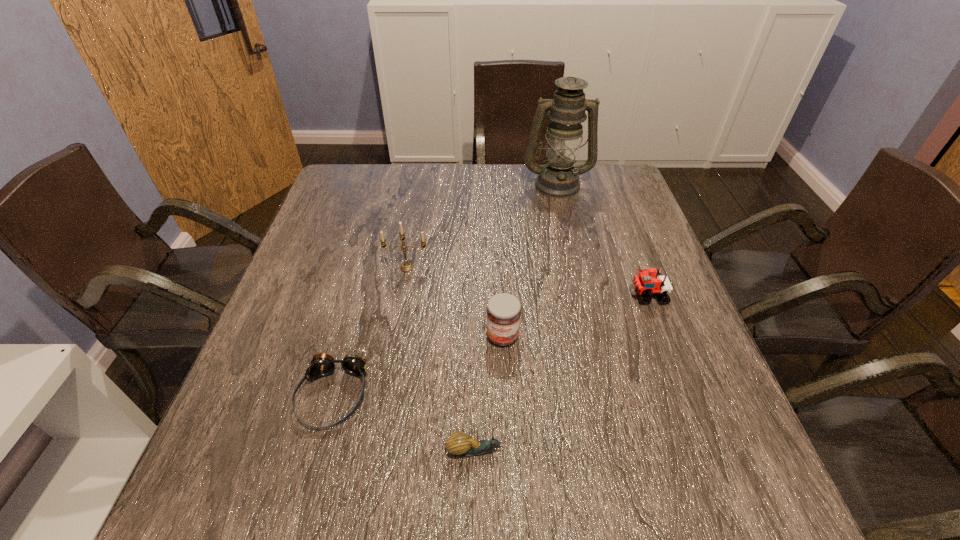
You are a GUI agent. You are given a task and a screenshot of the screen. Output one action in this format:
    pyautogui.click(x=<x>, y=<y>)
    Task: Click on the blank area in the image that satisfies the following two spatial constraints: 1. on the back side of the fifth shortest object; 2. on the right side of the oil lamp
    The image size is (960, 540).
    Given the screenshot: What is the action you would take?
    pyautogui.click(x=421, y=184)